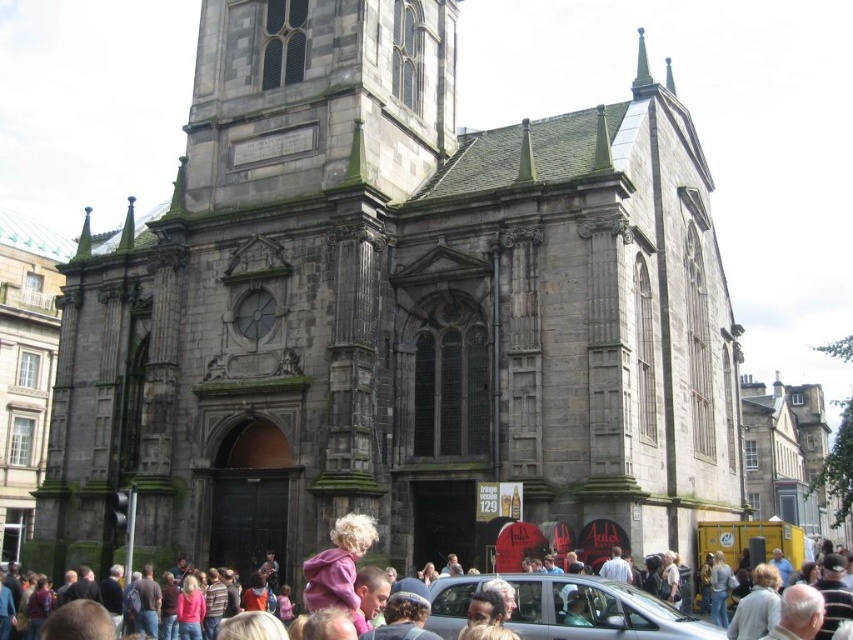
Does point (512, 577) come closer to viewer compared to point (370, 518)?

That is True.

Who is more distant from viewer, [595,577] or [339,516]?

Positioned behind is point [339,516].

Where is `metallic silver car at center`? metallic silver car at center is located at coordinates point(567,609).

Between metallic silver car at center and multicolored casual clothing at lower center, which one has more height?

With more height is metallic silver car at center.

Does metallic silver car at center appear over multicolored casual clothing at lower center?

Actually, metallic silver car at center is below multicolored casual clothing at lower center.

You are a GUI agent. You are given a task and a screenshot of the screen. Output one action in this format:
    pyautogui.click(x=<x>, y=<y>)
    Task: Click on the metallic silver car at center
    This screenshot has width=853, height=640.
    Given the screenshot: What is the action you would take?
    pyautogui.click(x=567, y=609)

At what (x,y) coordinates should I click in order to perform the action: click on metallic silver car at center. Please return your answer as a coordinate pair (x, y). The image size is (853, 640). Looking at the image, I should click on (567, 609).

Is multicolored casual clothing at lower center smaller than purple fleece at center?

Yes.

Who is more forward, (x=659, y=611) or (x=346, y=540)?

Point (x=346, y=540)

Is point (548, 621) positioned behind point (326, 554)?

Yes, point (548, 621) is farther from viewer.

Where is `multicolored casual clothing at lower center`? This screenshot has width=853, height=640. multicolored casual clothing at lower center is located at coordinates (585, 611).